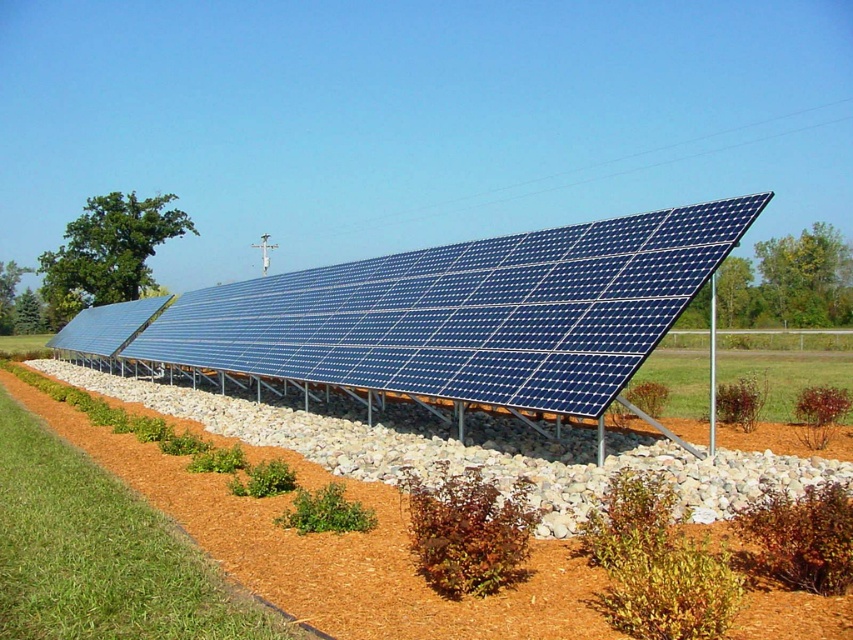
Question: Which point is farther from the camera taking this photo?

Choices:
 (A) (532, 259)
 (B) (79, 436)

Answer: (B)

Question: Does blue solar panel at center appear on the left side of brown mulch at lower center?

Choices:
 (A) no
 (B) yes

Answer: (B)

Question: Can you confirm if blue solar panel at center is positioned above brown mulch at lower center?

Choices:
 (A) no
 (B) yes

Answer: (B)

Question: Where is blue solar panel at center located in relation to brown mulch at lower center in the image?

Choices:
 (A) right
 (B) left

Answer: (B)